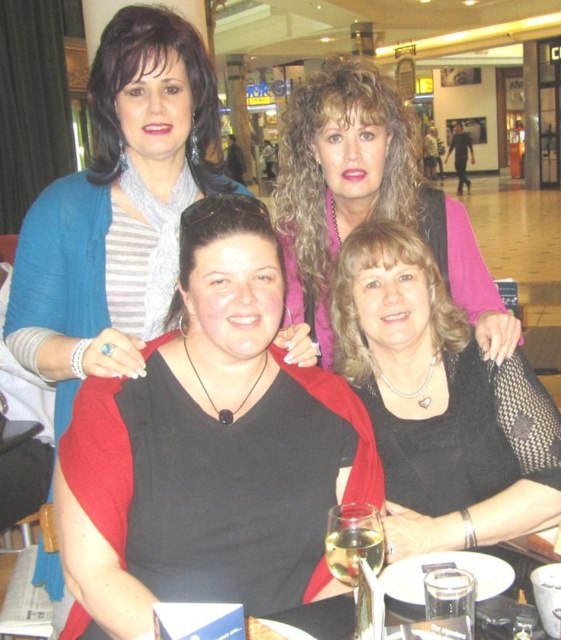
Which is behind, point (192, 376) or point (295, 237)?

Point (295, 237)

Is the position of black matte shirt at center less distant than that of matte pink sweater at upper center?

Yes, black matte shirt at center is closer to the viewer.

Is point (312, 381) less distant than point (310, 163)?

Yes.

Identify the location of black matte shirt at center. point(218,435).

Does point (422, 419) come in front of point (321, 330)?

Yes, point (422, 419) is closer to viewer.

Find the location of `black matte dress at center`. black matte dress at center is located at coordinates (439, 403).

This screenshot has width=561, height=640. In order to click on black matte dress at center in this screenshot , I will do `click(439, 403)`.

Is black matte shirt at center taller than black matte dress at center?

Indeed, black matte shirt at center has a greater height compared to black matte dress at center.

Is black matte shirt at center further to camera compared to black matte dress at center?

No, black matte shirt at center is closer to the viewer.

Where is `black matte shirt at center`? The height and width of the screenshot is (640, 561). black matte shirt at center is located at coordinates (218, 435).